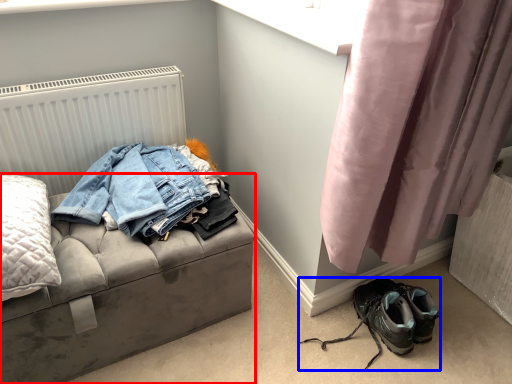
Question: Which object is further to the camera taking this photo, furniture (highlighted by a red box) or footwear (highlighted by a blue box)?

Choices:
 (A) furniture
 (B) footwear

Answer: (B)